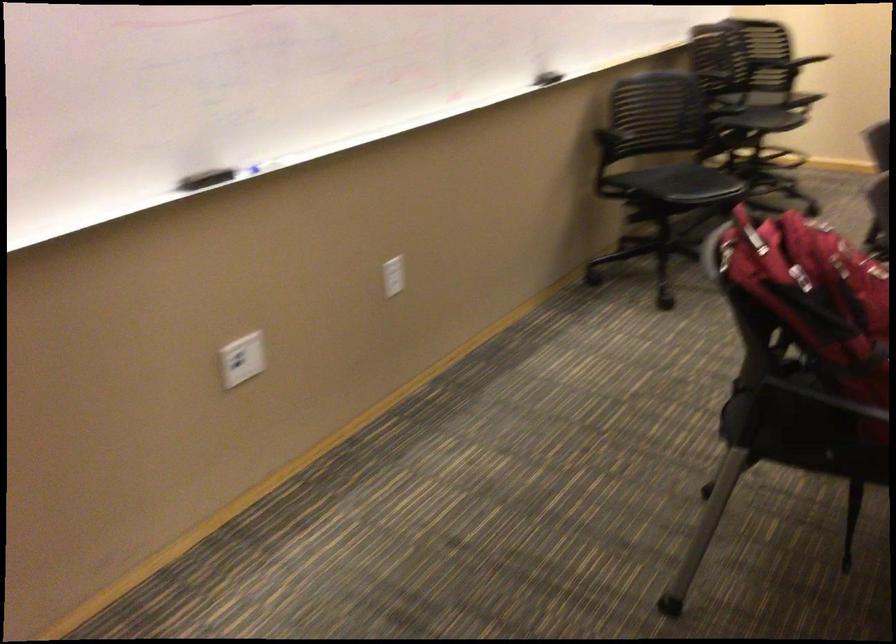
The height and width of the screenshot is (644, 896). Identify the location of red backpack. (815, 295).